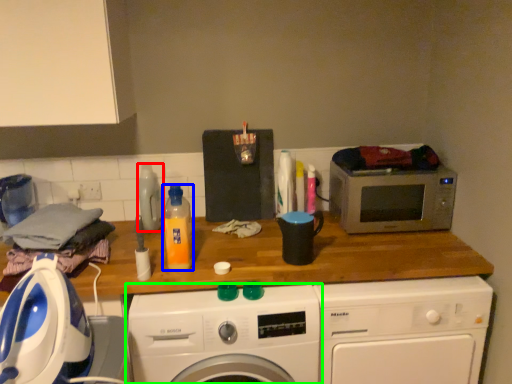
Question: Based on their relative distances, which object is farther from bottle (highlighted by a red box)? Choose from bottle (highlighted by a blue box) and washing machine (highlighted by a green box).

Choices:
 (A) bottle
 (B) washing machine

Answer: (B)